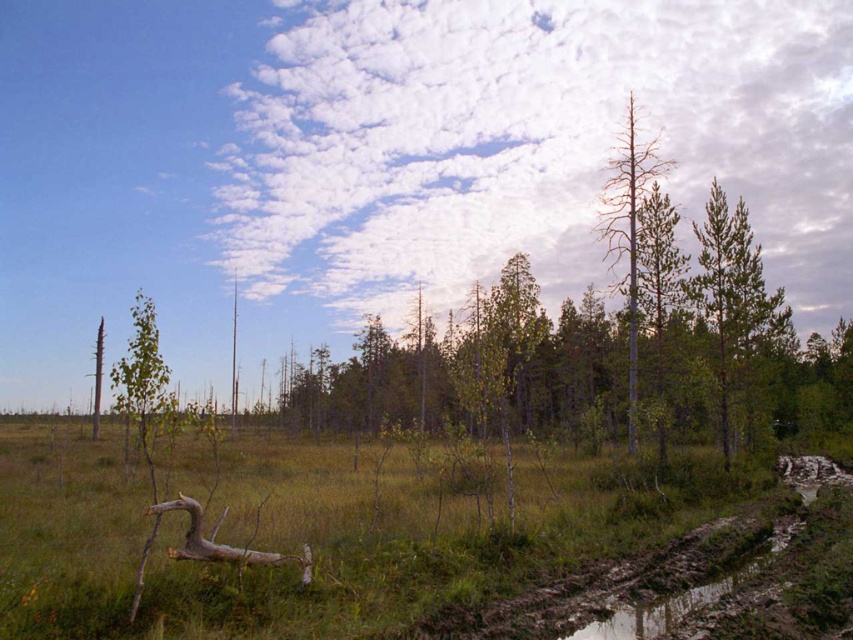
Question: Which object is positioned closest to the brown bark tree at right?

Choices:
 (A) green matte tree at right
 (B) smooth brown tree trunk at left

Answer: (A)

Question: Does brown bark tree at right lie behind smooth brown tree trunk at left?

Choices:
 (A) yes
 (B) no

Answer: (B)

Question: Does green matte tree at right appear under smooth brown tree trunk at left?

Choices:
 (A) yes
 (B) no

Answer: (B)

Question: Is green matte tree at right positioned behind smooth brown tree trunk at left?

Choices:
 (A) no
 (B) yes

Answer: (A)

Question: Which point appears closest to the camera in this image?

Choices:
 (A) (637, 324)
 (B) (97, 392)

Answer: (A)

Question: Based on their relative distances, which object is nearer to the brown bark tree at right?

Choices:
 (A) green matte tree at right
 (B) smooth brown tree trunk at left

Answer: (A)